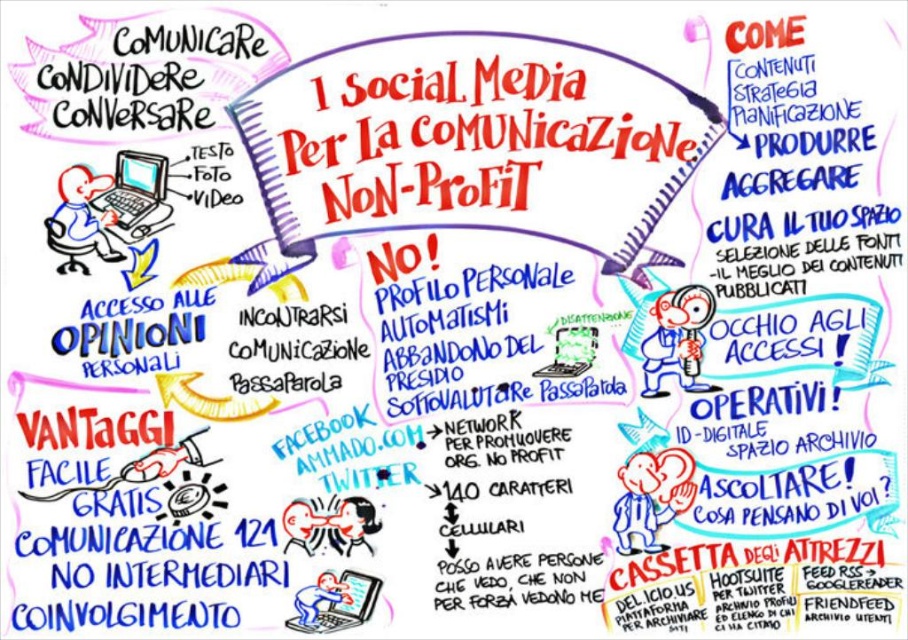
Question: Which object is farther from the camera taking this photo?

Choices:
 (A) matte black laptop at lower left
 (B) matte blue laptop at left

Answer: (A)

Question: Which point is farther to the camera?

Choices:
 (A) (329, 579)
 (B) (122, 216)

Answer: (A)

Question: From the image, what is the correct spatial relationship of matte blue laptop at left in relation to matte black laptop at lower left?

Choices:
 (A) left
 (B) right

Answer: (A)

Question: Which object appears farthest from the camera in this image?

Choices:
 (A) matte blue laptop at left
 (B) matte black laptop at lower left

Answer: (B)

Question: From the image, what is the correct spatial relationship of matte blue laptop at left in relation to matte black laptop at lower left?

Choices:
 (A) above
 (B) below

Answer: (A)

Question: Does matte blue laptop at left have a smaller size compared to matte black laptop at lower left?

Choices:
 (A) no
 (B) yes

Answer: (A)